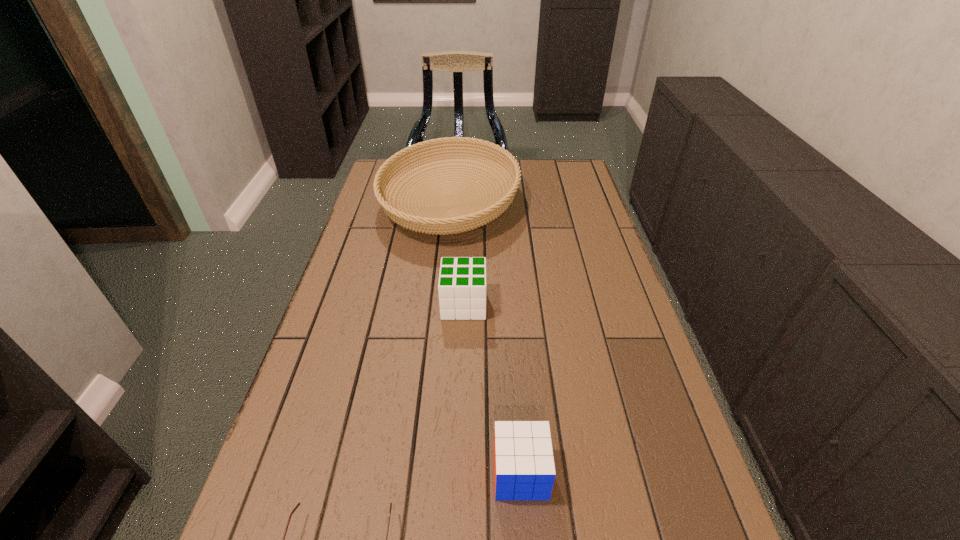
Locate an element on the screen. object that is at the far left corner is located at coordinates (433, 220).

This screenshot has height=540, width=960. Find the location of `vacant space at the far edge of the desktop`. vacant space at the far edge of the desktop is located at coordinates (498, 174).

The height and width of the screenshot is (540, 960). I want to click on vacant space at the left edge of the desktop, so click(x=345, y=255).

In the image, there is a desktop. Identify the location of vacant space at the right edge. (574, 279).

Where is `free region at the far right corner of the desktop`? The image size is (960, 540). free region at the far right corner of the desktop is located at coordinates tap(577, 187).

The height and width of the screenshot is (540, 960). In order to click on unoccupied position between the second nearest object and the basket in this screenshot , I will do point(486,338).

Locate an element on the screen. Image resolution: width=960 pixels, height=540 pixels. vacant space in between the shorter cube and the left cube is located at coordinates (492, 389).

At what (x,y) coordinates should I click in order to perform the action: click on free space between the basket and the second shortest object. Please return your answer as a coordinate pair (x, y). This screenshot has height=540, width=960. Looking at the image, I should click on (486, 338).

You are a GUI agent. You are given a task and a screenshot of the screen. Output one action in this format:
    pyautogui.click(x=<x>, y=<y>)
    Task: Click on the free space between the right cube and the basket
    The image size is (960, 540).
    Given the screenshot: What is the action you would take?
    pyautogui.click(x=486, y=338)

Where is `free space between the farther cube and the second nearest object`? free space between the farther cube and the second nearest object is located at coordinates (492, 389).